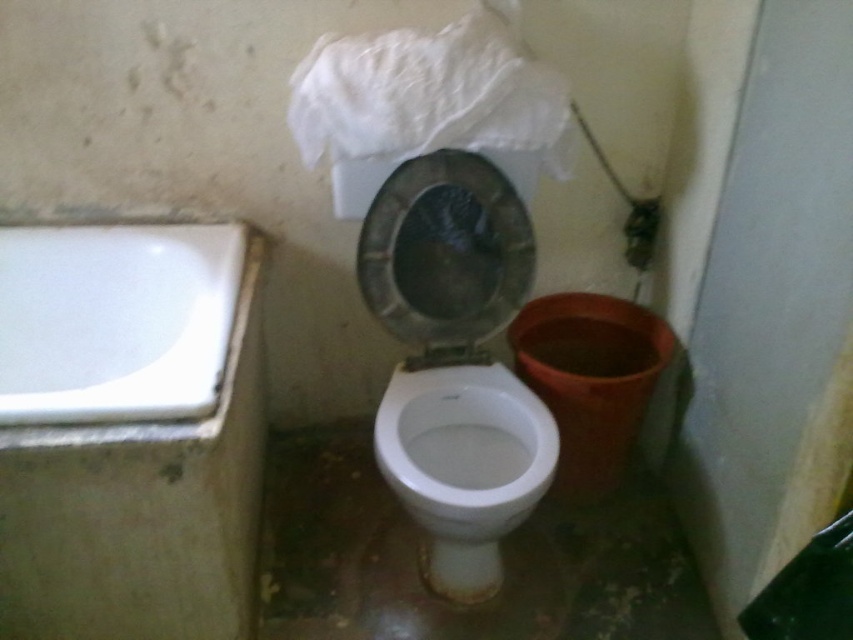
You are a maintenance worker holding a 1.0 meter long cleaning tool. You are standing in the bathroom and need to clean the white glossy bathtub at left. Can you reach it without moving closer?

The white glossy bathtub at left is 1.12 meters away from camera. Since the tool is 1.0 meters long, you cannot reach it without moving closer.

Based on the photo, you are a maintenance worker inspecting the bathroom. You need to reach the white glossy bathtub at left. Based on its coordinates, is it positioned closer to the left or right wall?

The white glossy bathtub at left is located at point (114, 321), which places it closer to the left wall since its x coordinate is 0.502, meaning it is halfway between the left and right walls, but since it is at the left side of the frame as described in the scene, it is positioned closer to the left wall.